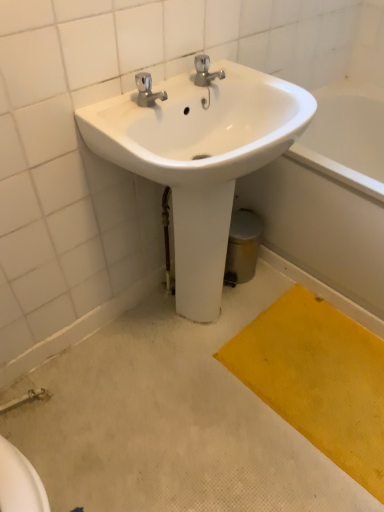
Identify the location of free location to the right of white glossy sink at upper center. (314, 348).